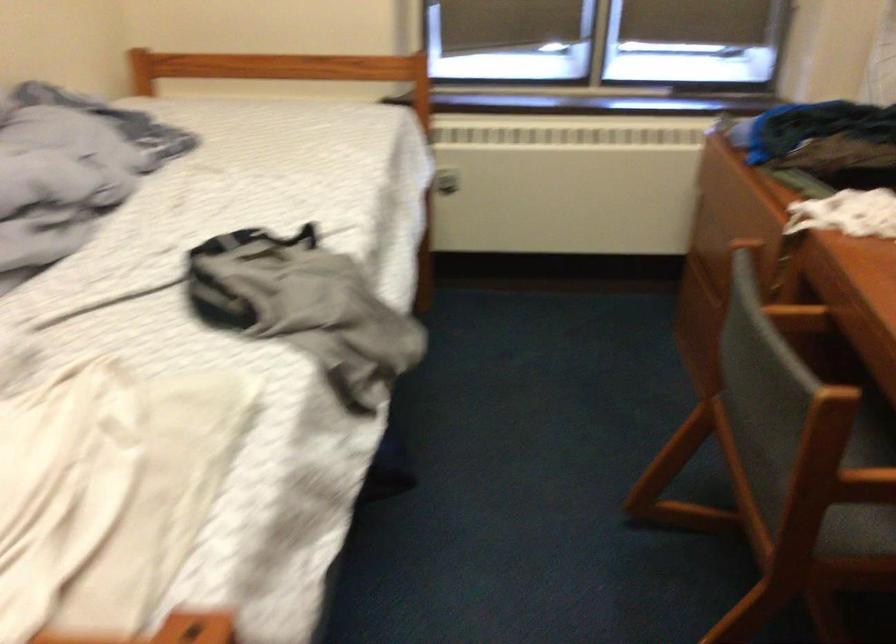
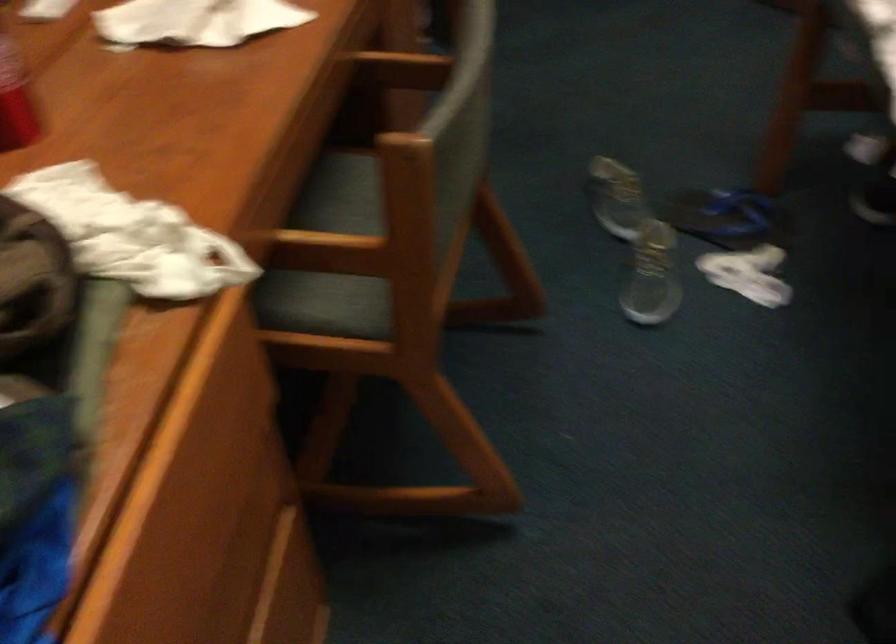
Where in the second image is the point corresponding to (x=787, y=315) from the first image?

(339, 250)